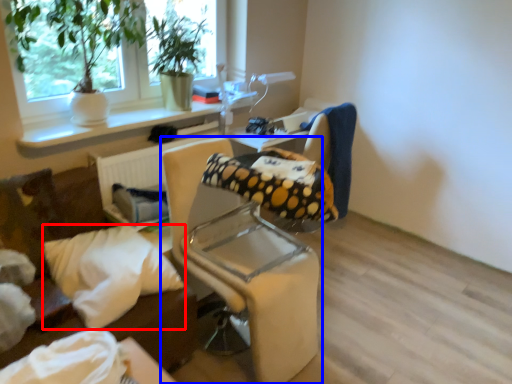
Question: Which of the following is the farthest to the observer, pillow (highlighted by a red box) or chair (highlighted by a blue box)?

Choices:
 (A) pillow
 (B) chair

Answer: (A)